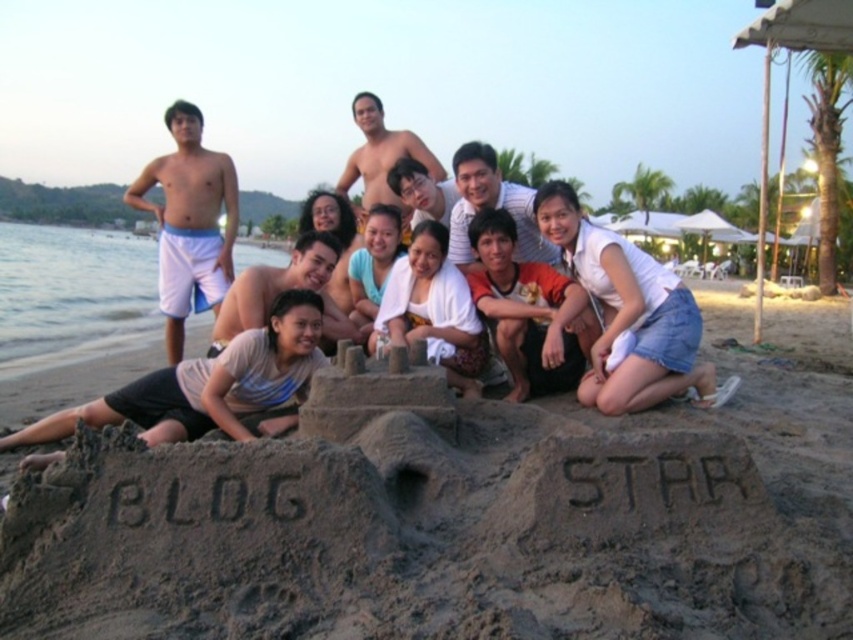
You are standing on the beach and want to grab your towel to sit on. You see the white cotton shirt at lower center and the white towel at center. Which object is closer to you?

The white cotton shirt at lower center is closer to you because it is further to the viewer than the white towel at center.

You are packing for a beach trip and have a white cotton shirt at lower center and a white towel at center. Which item takes up less space in your bag?

The white cotton shirt at lower center is smaller than the white towel at center, so it takes up less space in your bag.